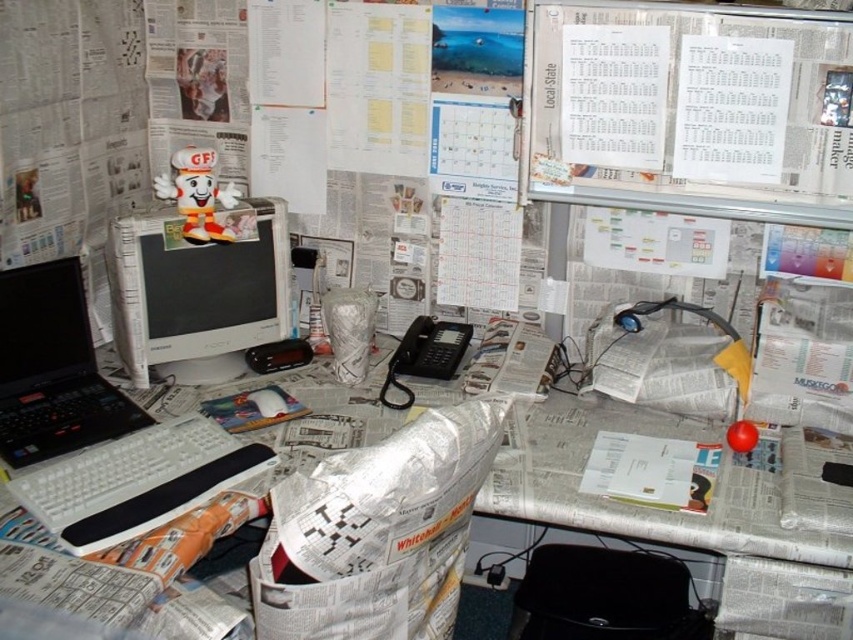
Who is taller, white paper computer desk at center or black matte laptop at left?

With more height is white paper computer desk at center.

Is white paper computer desk at center shorter than black matte laptop at left?

No.

The image size is (853, 640). What do you see at coordinates (654, 508) in the screenshot?
I see `white paper computer desk at center` at bounding box center [654, 508].

Image resolution: width=853 pixels, height=640 pixels. In order to click on white paper computer desk at center in this screenshot , I will do `click(654, 508)`.

Is point (604, 192) in front of point (727, 529)?

That is False.

You are a GUI agent. You are given a task and a screenshot of the screen. Output one action in this format:
    pyautogui.click(x=<x>, y=<y>)
    Task: Click on the whiteboard at upper right
    
    Given the screenshot: What is the action you would take?
    pyautogui.click(x=691, y=104)

Which of these two, white paper computer desk at center or white plastic keyboard at lower left, stands taller?

white paper computer desk at center

Which is behind, point (817, 496) or point (111, 440)?

The point (111, 440) is behind.

Between point (498, 502) and point (120, 452), which one is positioned in front?

Point (498, 502) is in front.

Where is `white paper computer desk at center`? white paper computer desk at center is located at coordinates (654, 508).